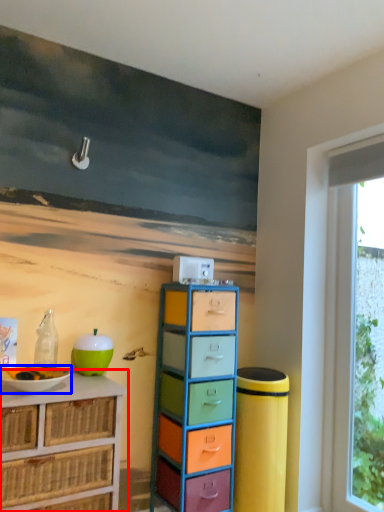
Question: Among these objects, which one is nearest to the camera, chest of drawers (highlighted by a red box) or bowl (highlighted by a blue box)?

Choices:
 (A) chest of drawers
 (B) bowl

Answer: (A)